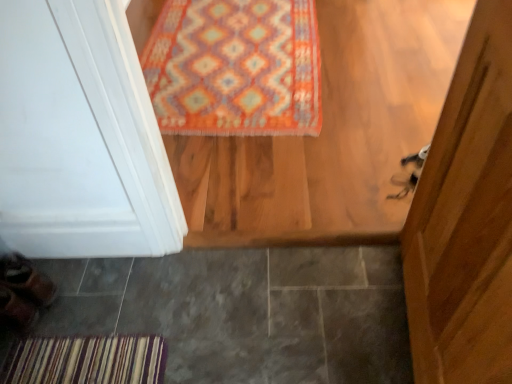
Locate an element on the screen. vacant area on top of multicolored woven rug at upper center (from a real-world perspective) is located at coordinates (250, 52).